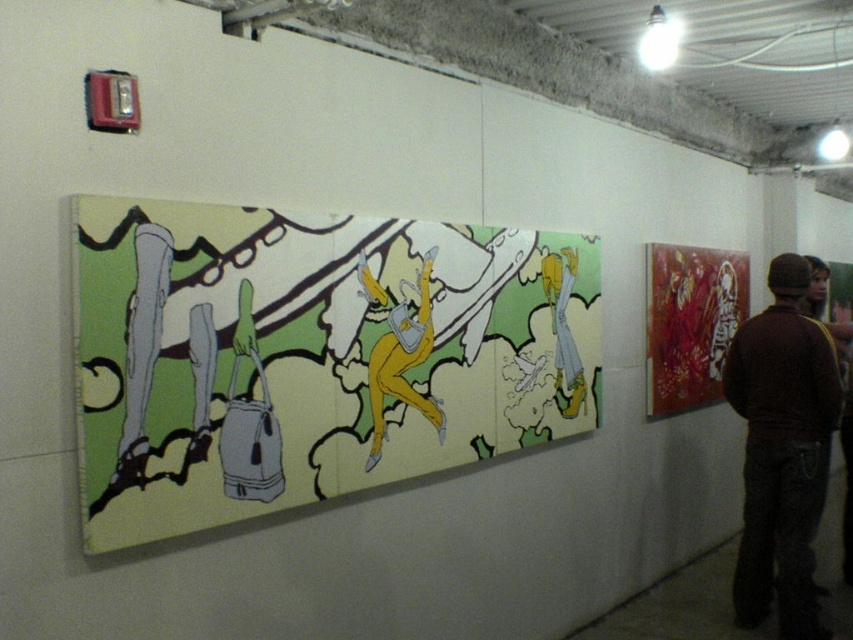
You are an art critic standing 1.5 meters away from the matte canvas painting at center. Can you comfortably view the entire painting without moving your head?

The matte canvas painting at center is 2.07 meters away from the camera. Since you are standing 1.5 meters away, you are closer than the camera and can comfortably view the entire painting without moving your head.

You are an art curator planning to hang a new sculpture between the matte canvas painting at center and the brown sweater at right. The sculpture requires at least 1 meter of space between the two objects. Can you fit it there?

The matte canvas painting at center is larger in size than the brown sweater at right, but the exact distance between them isn t specified. Without knowing the actual spacing, it s impossible to determine if there s enough room for the sculpture requiring 1 meter of space.